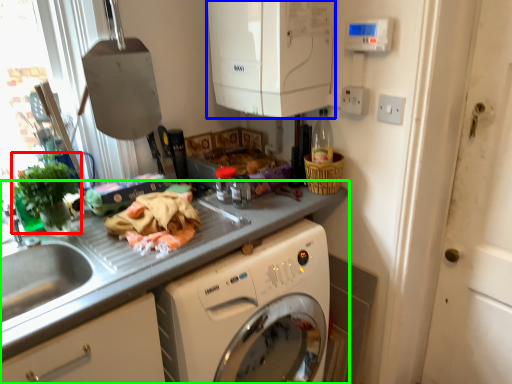
Question: Estimate the real-world distances between objects in this image. Which object is farther from plant (highlighted by a red box), appliance (highlighted by a blue box) or countertop (highlighted by a green box)?

Choices:
 (A) appliance
 (B) countertop

Answer: (A)